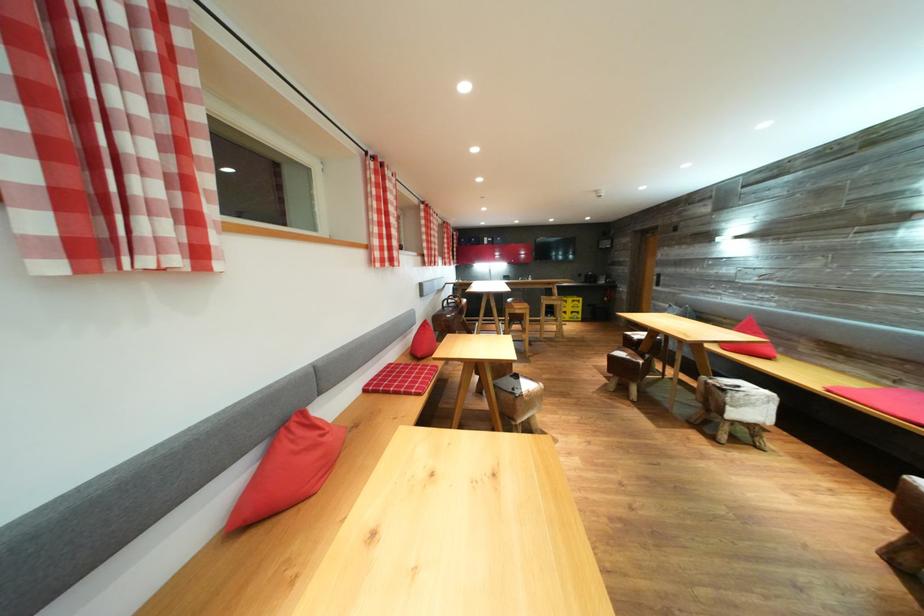
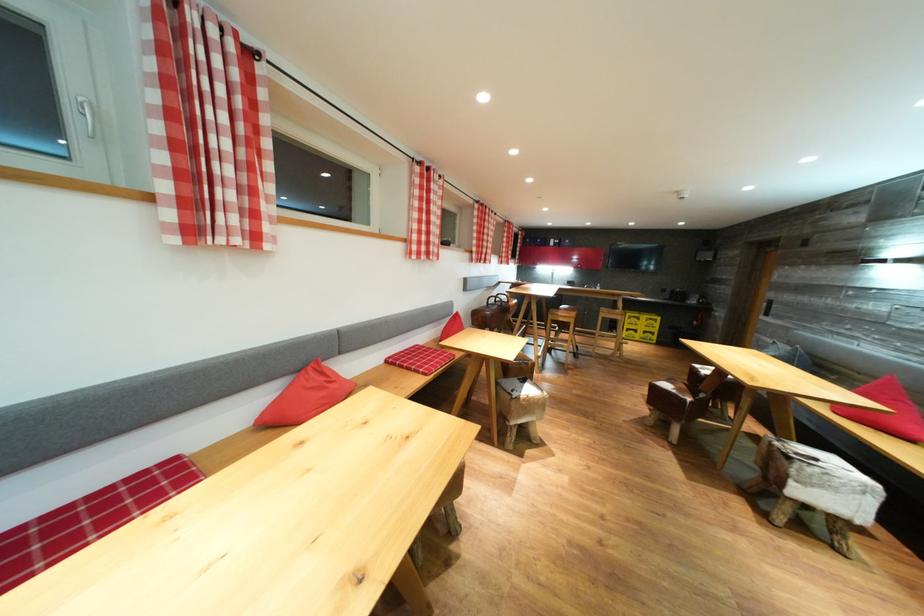
Find the pixel in the second image that matches the point at 320,431 in the first image.

(330, 378)